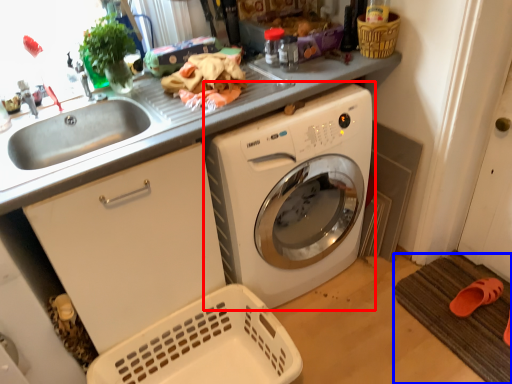
Question: Which object is closer to the camera taking this photo, washing machine (highlighted by a red box) or bath mat (highlighted by a blue box)?

Choices:
 (A) washing machine
 (B) bath mat

Answer: (A)